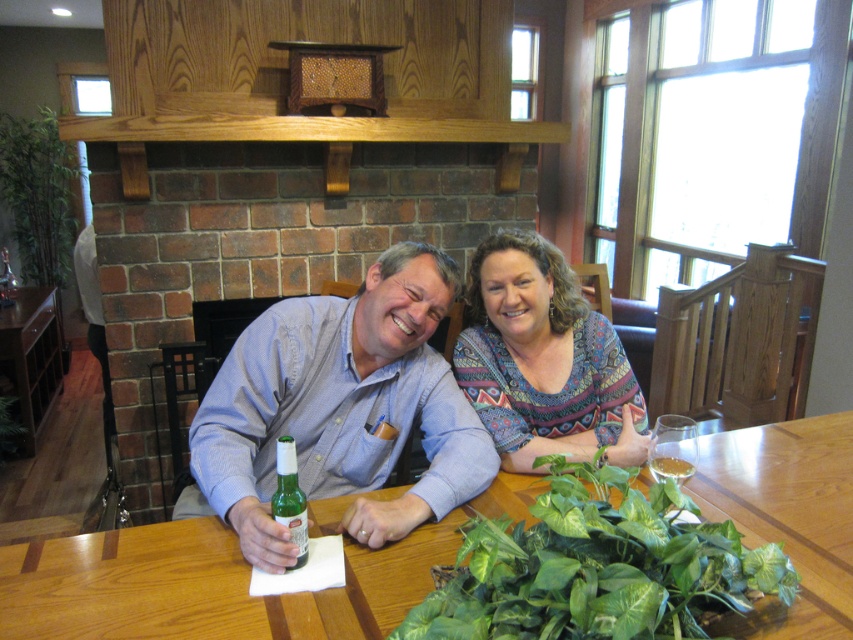
You are a waiter at a restaurant and need to place a dessert menu between the clear glass wine glass at right and the green glass bottle at center. Based on their positions, where should you place the dessert menu so it doesn

The clear glass wine glass at right is in front of the green glass bottle at center, so placing the dessert menu behind the clear glass wine glass at right and in front of the green glass bottle at center would be appropriate.

You are a photographer standing in front of the wooden table at center. You want to take a closeup shot of the table. The camera requires the subject to be at least 40 inches away from the lens to focus properly. Can you take the photo without moving the table?

The wooden table at center is 38.31 inches from camera, which is less than the required 40 inches. Therefore, you cannot take the photo without moving the table closer or using a different camera setting that allows closer focusing.